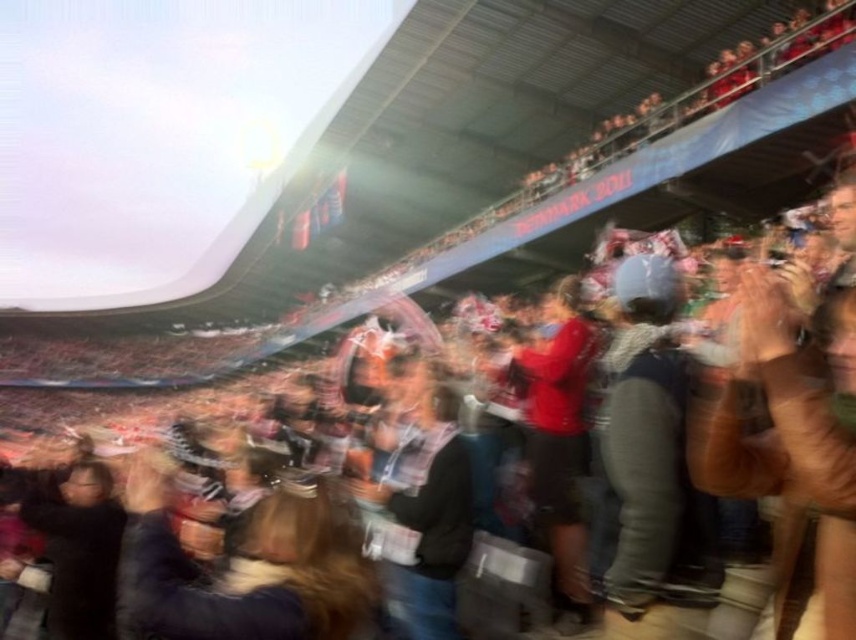
Is dark brown leather jacket at center positioned in front of dark gray fabric crowd at center?

No.

Who is positioned more to the right, dark brown leather jacket at center or dark gray fabric crowd at center?

dark gray fabric crowd at center is more to the right.

Locate an element on the screen. dark brown leather jacket at center is located at coordinates (247, 564).

I want to click on dark brown leather jacket at center, so click(x=247, y=564).

Is dark gray sweater at center wider than dark gray fabric crowd at center?

Yes.

Between dark gray sweater at center and dark gray fabric crowd at center, which one has less height?

dark gray fabric crowd at center is shorter.

Locate an element on the screen. The width and height of the screenshot is (856, 640). dark gray sweater at center is located at coordinates (432, 531).

Image resolution: width=856 pixels, height=640 pixels. Find the location of `dark gray sweater at center`. dark gray sweater at center is located at coordinates (432, 531).

Who is higher up, dark brown leather jacket at center or dark gray sweater at center?

dark gray sweater at center is above.

Who is positioned more to the left, dark brown leather jacket at center or dark gray sweater at center?

From the viewer's perspective, dark brown leather jacket at center appears more on the left side.

Does point (132, 602) come behind point (434, 400)?

No, (132, 602) is closer to viewer.

Where is `dark brown leather jacket at center`? dark brown leather jacket at center is located at coordinates (247, 564).